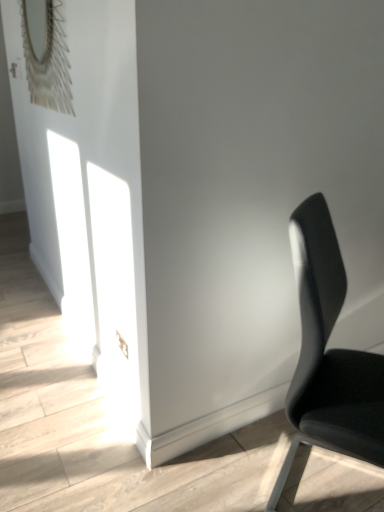
Describe the element at coordinates (328, 354) in the screenshot. I see `black leather chair at right` at that location.

Measure the distance between black leather chair at right and camera.

The depth of black leather chair at right is 3.49 feet.

The height and width of the screenshot is (512, 384). Identify the location of black leather chair at right. (328, 354).

What do you see at coordinates (46, 54) in the screenshot?
I see `matte silver mirror at upper left` at bounding box center [46, 54].

Identify the location of matte silver mirror at upper left. (46, 54).

Where is `black leather chair at right`? The image size is (384, 512). black leather chair at right is located at coordinates (328, 354).

Considering the positions of objects matte silver mirror at upper left and black leather chair at right in the image provided, who is more to the right, matte silver mirror at upper left or black leather chair at right?

Positioned to the right is black leather chair at right.

Considering their positions, is matte silver mirror at upper left located in front of or behind black leather chair at right?

matte silver mirror at upper left is behind black leather chair at right.

Is point (71, 106) closer to camera compared to point (301, 359)?

No, it is not.

Based on the photo, from the image's perspective, is matte silver mirror at upper left beneath black leather chair at right?

No, from the image's perspective, matte silver mirror at upper left is not below black leather chair at right.

From a real-world perspective, is matte silver mirror at upper left over black leather chair at right?

Yes, from a real-world perspective, matte silver mirror at upper left is over black leather chair at right

Which of these two, matte silver mirror at upper left or black leather chair at right, is thinner?

Thinner between the two is matte silver mirror at upper left.

Which of these two, matte silver mirror at upper left or black leather chair at right, stands taller?

black leather chair at right.

Can you confirm if matte silver mirror at upper left is bigger than black leather chair at right?

No.

Is matte silver mirror at upper left not within black leather chair at right?

Yes, matte silver mirror at upper left is outside of black leather chair at right.

Are matte silver mirror at upper left and black leather chair at right beside each other?

No, matte silver mirror at upper left is not next to black leather chair at right.

Is matte silver mirror at upper left looking in the opposite direction of black leather chair at right?

No, black leather chair at right is not at the back of matte silver mirror at upper left.

How many degrees apart are the facing directions of matte silver mirror at upper left and black leather chair at right?

122 degrees separate the facing orientations of matte silver mirror at upper left and black leather chair at right.

Identify the location of chair directly beneath the matte silver mirror at upper left (from a real-world perspective). (328, 354).

Between black leather chair at right and matte silver mirror at upper left, which one appears on the right side from the viewer's perspective?

black leather chair at right is more to the right.

Between black leather chair at right and matte silver mirror at upper left, which one is positioned in front?

Positioned in front is black leather chair at right.

Does point (310, 440) appear closer or farther from the camera than point (46, 91)?

Clearly, point (310, 440) is closer to the camera than point (46, 91).

From the image's perspective, which is above, black leather chair at right or matte silver mirror at upper left?

matte silver mirror at upper left appears higher in the image.

From a real-world perspective, who is located lower, black leather chair at right or matte silver mirror at upper left?

black leather chair at right is physically lower.

Which object is thinner, black leather chair at right or matte silver mirror at upper left?

With smaller width is matte silver mirror at upper left.

Can you confirm if black leather chair at right is shorter than matte silver mirror at upper left?

Incorrect, the height of black leather chair at right does not fall short of that of matte silver mirror at upper left.

Considering the sizes of objects black leather chair at right and matte silver mirror at upper left in the image provided, who is smaller, black leather chair at right or matte silver mirror at upper left?

matte silver mirror at upper left is smaller.

Is black leather chair at right spatially inside matte silver mirror at upper left, or outside of it?

black leather chair at right is located beyond the bounds of matte silver mirror at upper left.

Are black leather chair at right and matte silver mirror at upper left beside each other?

No.

Is black leather chair at right looking in the opposite direction of matte silver mirror at upper left?

Correct, black leather chair at right is looking away from matte silver mirror at upper left.

How many degrees apart are the facing directions of black leather chair at right and matte silver mirror at upper left?

The angle between the facing direction of black leather chair at right and the facing direction of matte silver mirror at upper left is 122 degrees.

Image resolution: width=384 pixels, height=512 pixels. Find the location of `chair in front of the matte silver mirror at upper left`. chair in front of the matte silver mirror at upper left is located at coordinates (328, 354).

This screenshot has height=512, width=384. Find the location of `mirror located behind the black leather chair at right`. mirror located behind the black leather chair at right is located at coordinates (46, 54).

Where is `chair lying on the right of matte silver mirror at upper left`? chair lying on the right of matte silver mirror at upper left is located at coordinates (328, 354).